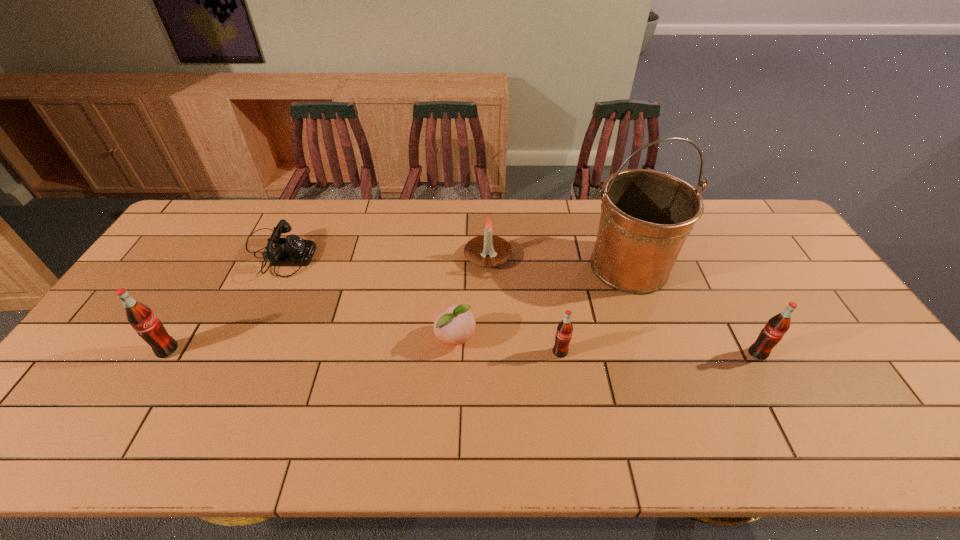
At what (x,y) coordinates should I click in order to perform the action: click on vacant space that satisfies the following two spatial constraints: 1. on the back side of the peach; 2. on the right side of the bucket. Please return your answer as a coordinate pair (x, y). The image size is (960, 540). Looking at the image, I should click on (459, 266).

Find the location of a particular element. The image size is (960, 540). free space that satisfies the following two spatial constraints: 1. on the back side of the second object from right to left; 2. on the left side of the peach is located at coordinates pos(459,266).

You are a GUI agent. You are given a task and a screenshot of the screen. Output one action in this format:
    pyautogui.click(x=<x>, y=<y>)
    Task: Click on the free region that satisfies the following two spatial constraints: 1. on the front-facing side of the candle; 2. on the right side of the second object from left to right
    The height and width of the screenshot is (540, 960).
    Given the screenshot: What is the action you would take?
    pyautogui.click(x=276, y=257)

Image resolution: width=960 pixels, height=540 pixels. Identify the location of blank area in the image that satisfies the following two spatial constraints: 1. on the front side of the candle; 2. on the label of the leftmost object. (490, 350).

Image resolution: width=960 pixels, height=540 pixels. What are the coordinates of `vacant area in the image that satisfies the following two spatial constraints: 1. on the back side of the candle; 2. on the front-facing side of the shortest object` in the screenshot? It's located at (488, 254).